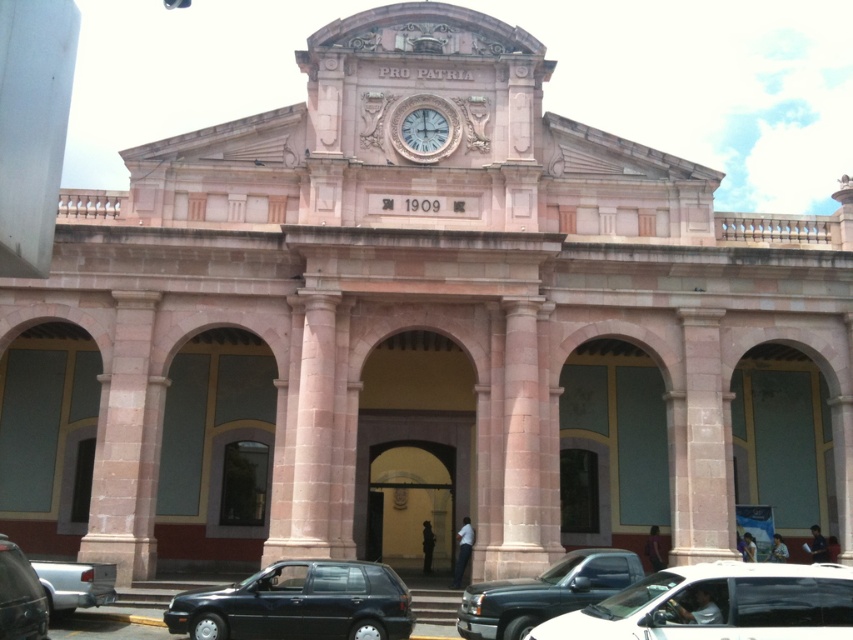
Question: Does matte black hatchback at lower left come in front of metallic gray truck at lower center?

Choices:
 (A) no
 (B) yes

Answer: (B)

Question: Is matte black car at center thinner than matte black hatchback at lower left?

Choices:
 (A) yes
 (B) no

Answer: (B)

Question: Estimate the real-world distances between objects in this image. Which object is closer to the matte black hatchback at lower left?

Choices:
 (A) white marble clock at center
 (B) metallic gray car at lower left

Answer: (B)

Question: Can you confirm if matte black car at center is smaller than white marble clock at center?

Choices:
 (A) no
 (B) yes

Answer: (A)

Question: Which is farther from the silver metallic truck at lower left?

Choices:
 (A) matte black hatchback at lower left
 (B) matte black car at center

Answer: (B)

Question: Considering the real-world distances, which object is farthest from the white marble clock at center?

Choices:
 (A) matte black car at center
 (B) silver metallic truck at lower left

Answer: (B)